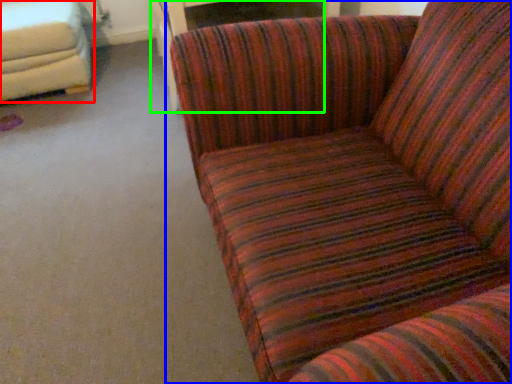
Question: Estimate the real-world distances between objects in this image. Which object is closer to studio couch (highlighted by a red box), studio couch (highlighted by a blue box) or table (highlighted by a green box)?

Choices:
 (A) studio couch
 (B) table

Answer: (B)